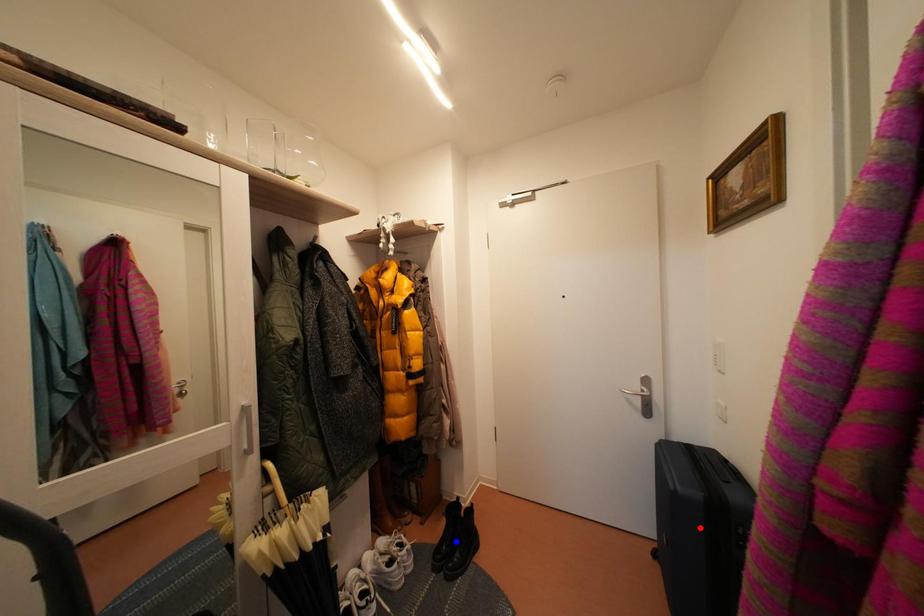
Question: In the image, two points are highlighted. Which point is nearer to the camera? Reply with the corresponding letter.

Choices:
 (A) blue point
 (B) red point

Answer: (B)